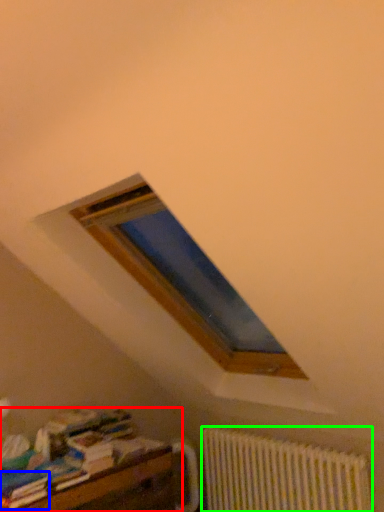
Question: Which object is positioned farthest from furniture (highlighted by a red box)? Select from paperback book (highlighted by a blue box) and radiator (highlighted by a green box).

Choices:
 (A) paperback book
 (B) radiator

Answer: (B)